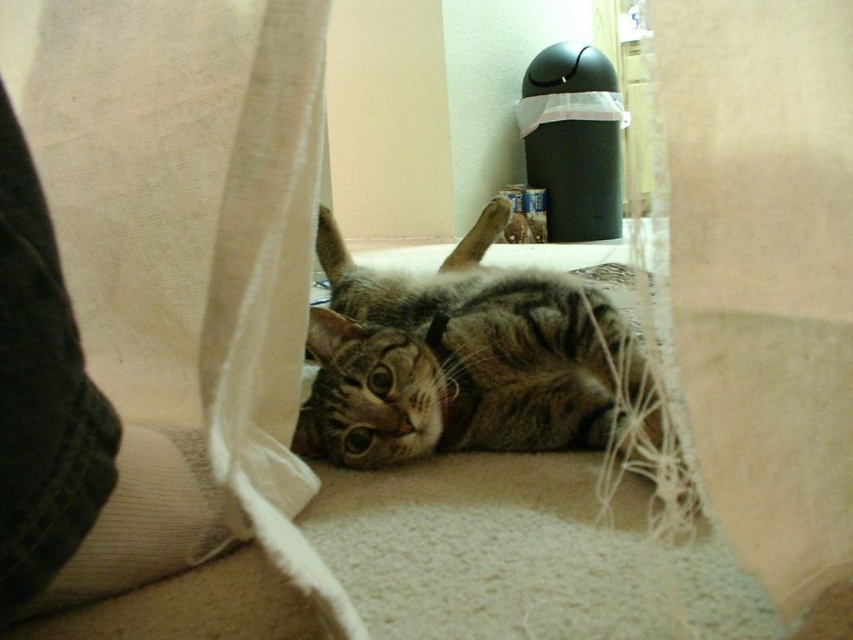
You are a pet sitter checking on the tabby fur cat at center. The cat is inside an enclosure made from the white fabric curtain at lower left. Can you determine if the curtain is long enough to fully cover the cat?

The white fabric curtain at lower left is shorter than the tabby fur cat at center, so the curtain is not long enough to fully cover the cat.

You are standing in the room where the tabby cat is resting. There is a white fabric curtain at lower left located at point (183, 266). If you want to place a small toy for the cat to play with, where should you put it so that it is closest to the cat but not too near the trash bin?

The white fabric curtain at lower left is located at point (183, 266). To place the toy closest to the cat but not too near the trash bin, position it near the cat but away from the trash bin area.

You are a photographer trying to capture the tabby fur cat at center in the image. If you want to position the cat exactly at the center of the frame, which coordinates should you aim for?

The tabby fur cat at center is already positioned at the coordinates point [463,358], which is very close to the center of the frame. To ensure it remains centered, aim for those coordinates.